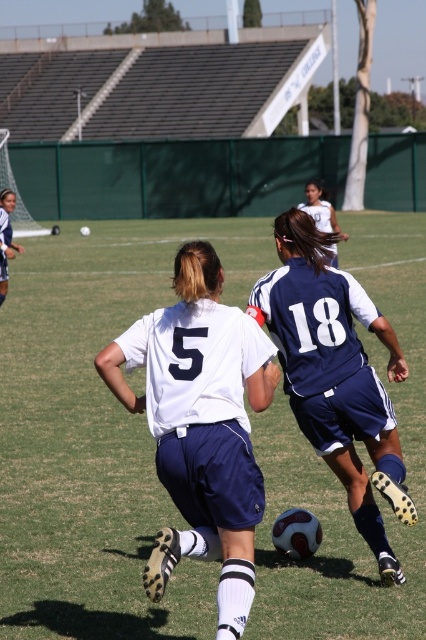
Question: Is green grass soccer ball at center to the left of white jersey at center from the viewer's perspective?

Choices:
 (A) no
 (B) yes

Answer: (B)

Question: Estimate the real-world distances between objects in this image. Which object is closer to the white jersey at center?

Choices:
 (A) white matte jersey at center
 (B) blue fabric soccer jersey at center
 (C) green grass soccer ball at center

Answer: (C)

Question: Is white matte jersey at center behind blue fabric soccer jersey at center?

Choices:
 (A) no
 (B) yes

Answer: (A)

Question: Which point appears closest to the camera in this image?

Choices:
 (A) (132, 337)
 (B) (370, 262)
 (C) (296, 340)

Answer: (A)

Question: Does green grass soccer ball at center appear on the left side of white jersey at center?

Choices:
 (A) yes
 (B) no

Answer: (A)

Question: Which point appears closest to the camera in this image?

Choices:
 (A) (57, 404)
 (B) (129, 403)
 (C) (305, 204)

Answer: (B)